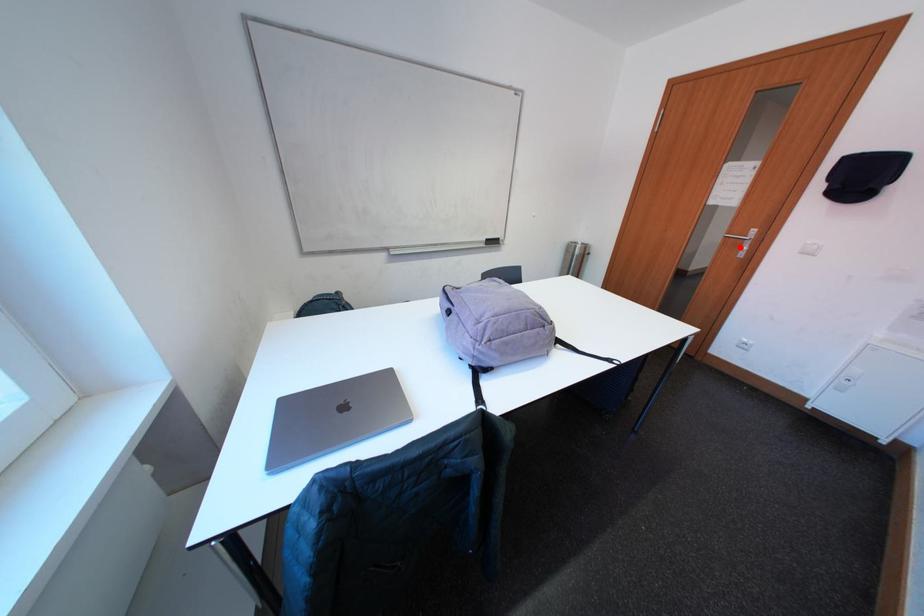
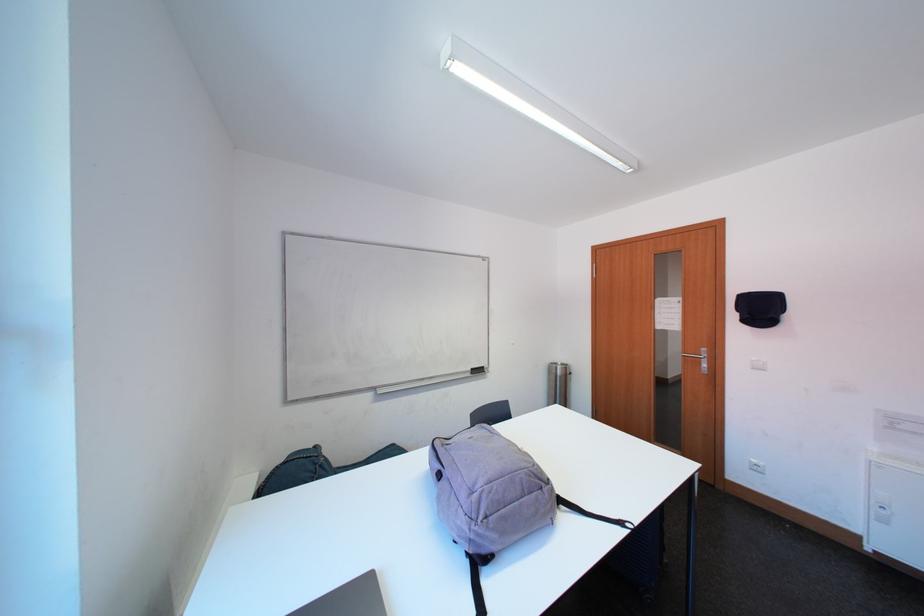
Question: I am providing you with two images of the same scene from different viewpoints. Given a red point in image1, look at the same physical point in image2. Is it:

Choices:
 (A) Closer to the viewpoint
 (B) Farther from the viewpoint

Answer: (A)